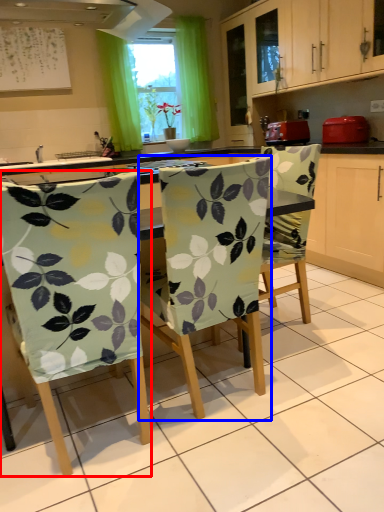
Question: Which point is further to the camera, chair (highlighted by a red box) or chair (highlighted by a blue box)?

Choices:
 (A) chair
 (B) chair

Answer: (B)